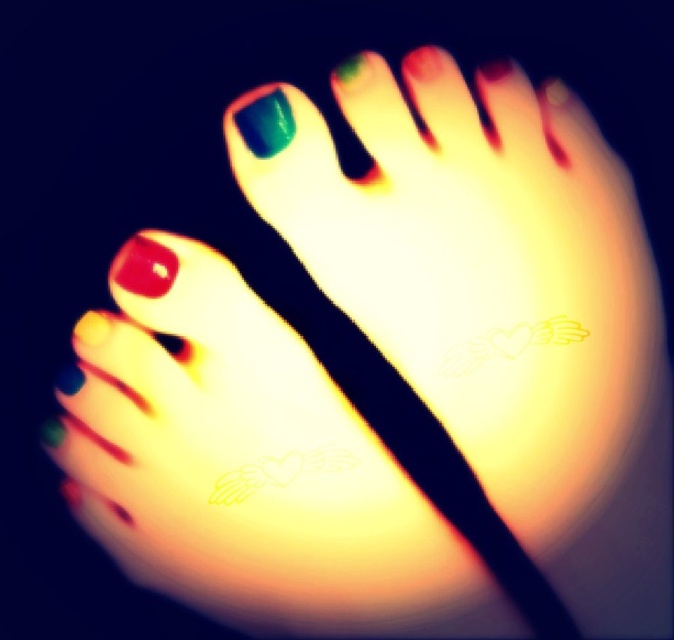
Question: Which object is positioned closest to the green glossy nail at upper center?

Choices:
 (A) shiny red nail at lower left
 (B) matte red nail at center

Answer: (B)

Question: Can you confirm if matte red nail at center is wider than shiny red nail at lower left?

Choices:
 (A) no
 (B) yes

Answer: (B)

Question: Which of the following is the closest to the observer?

Choices:
 (A) pos(91,317)
 (B) pos(275,113)

Answer: (B)

Question: Can you confirm if matte red nail at center is bigger than shiny red nail at lower left?

Choices:
 (A) yes
 (B) no

Answer: (A)

Question: Which object appears closest to the camera in this image?

Choices:
 (A) matte red nail at center
 (B) shiny red nail at lower left

Answer: (A)

Question: Observing the image, what is the correct spatial positioning of matte red nail at center in reference to green glossy nail at upper center?

Choices:
 (A) left
 (B) right

Answer: (A)